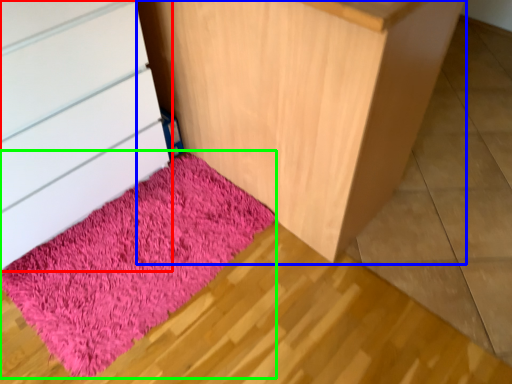
Question: Estimate the real-world distances between objects in this image. Which object is farther from chest of drawers (highlighted by a red box), furniture (highlighted by a blue box) or mat (highlighted by a green box)?

Choices:
 (A) furniture
 (B) mat

Answer: (A)